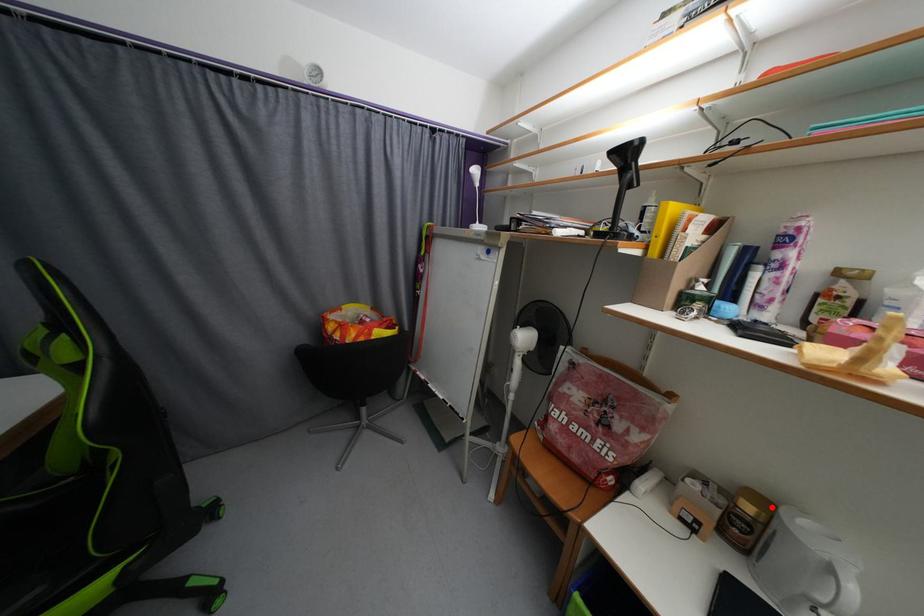
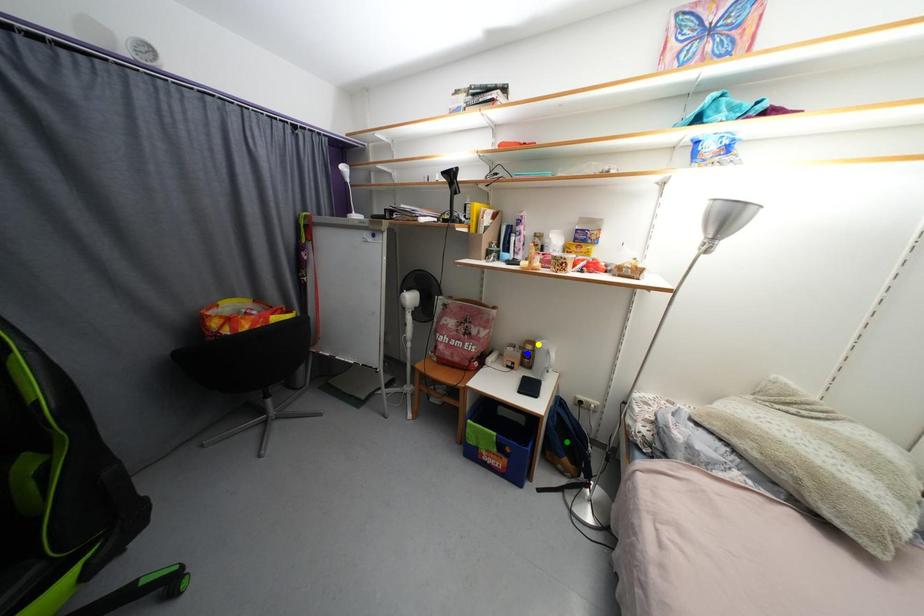
Question: I am providing you with two images of the same scene from different viewpoints. A red point is marked on the first image. You are given multiple points on the second image. Which point in image 2 represents the same 3d spot as the red point in image 1?

Choices:
 (A) blue point
 (B) green point
 (C) yellow point

Answer: (C)